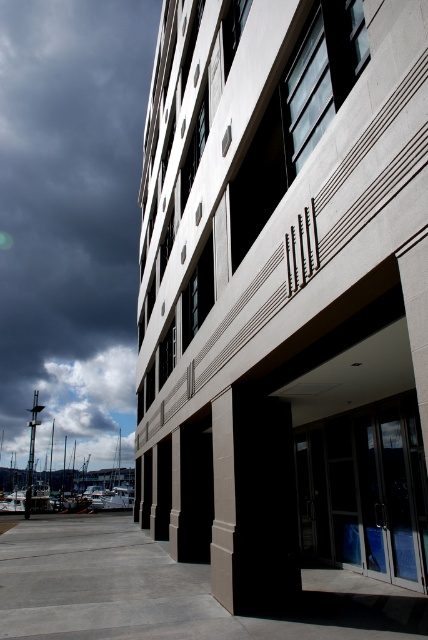
Question: Can you confirm if gray concrete pavement at lower center is bigger than white fluffy cloud at upper left?

Choices:
 (A) no
 (B) yes

Answer: (A)

Question: Where is dark cloudy sky at upper left located in relation to white glossy boats at lower left in the image?

Choices:
 (A) above
 (B) below

Answer: (A)

Question: Which is nearer to the transparent glass doors at center?

Choices:
 (A) smooth concrete pillar at center
 (B) white fluffy cloud at upper left
 (C) white glossy boats at lower left
 (D) gray concrete pavement at lower center

Answer: (A)

Question: Can you confirm if white fluffy cloud at upper left is positioned above white glossy boats at lower left?

Choices:
 (A) yes
 (B) no

Answer: (A)

Question: Which point is farther to the camera?

Choices:
 (A) (306, 522)
 (B) (15, 253)

Answer: (B)

Question: Which object appears closest to the camera in this image?

Choices:
 (A) transparent glass doors at center
 (B) smooth concrete pillar at center
 (C) white glossy boats at lower left
 (D) dark cloudy sky at upper left

Answer: (B)